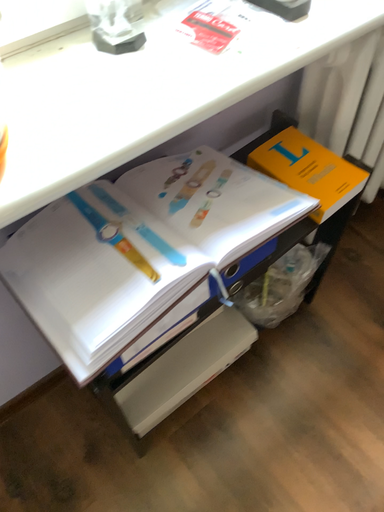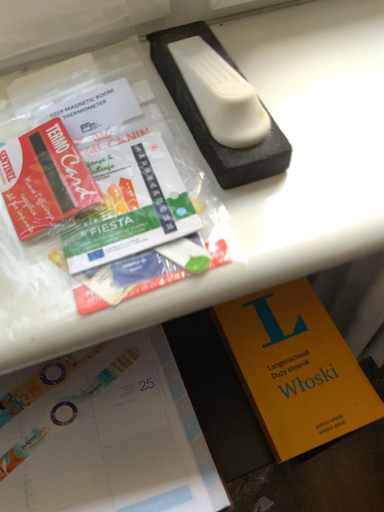
Question: How did the camera likely rotate when shooting the video?

Choices:
 (A) rotated left
 (B) rotated right

Answer: (A)